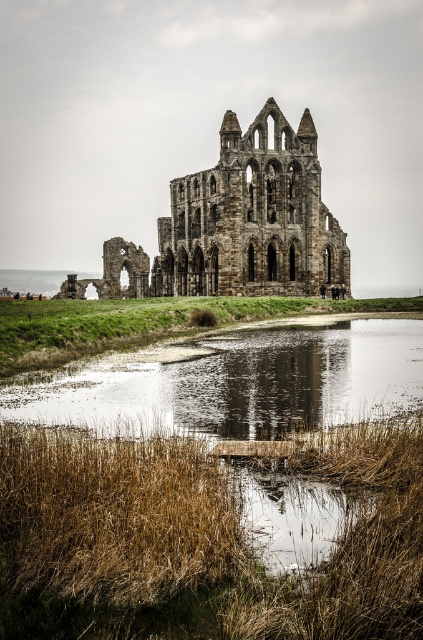
Question: In this image, where is brown dry reed at lower left located relative to stone gothic ruins at center?

Choices:
 (A) below
 (B) above

Answer: (A)

Question: Can you confirm if brown dry reed at lower left is smaller than stone gothic ruins at center?

Choices:
 (A) yes
 (B) no

Answer: (A)

Question: In this image, where is brown dry reed at lower left located relative to stone gothic ruins at center?

Choices:
 (A) left
 (B) right

Answer: (A)

Question: Among these points, which one is farthest from the camera?

Choices:
 (A) (77, 582)
 (B) (299, 230)

Answer: (B)